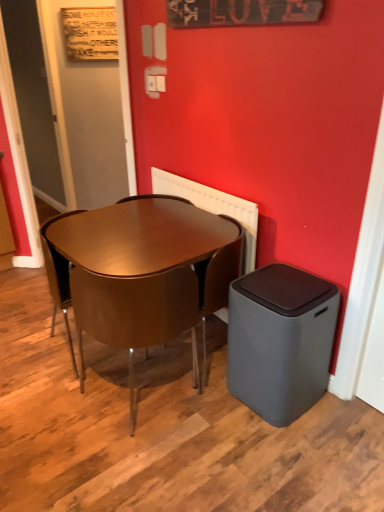
Find the location of a particular element. This screenshot has width=384, height=512. vacant area on top of matte brown table at center (from a real-world perspective) is located at coordinates (158, 228).